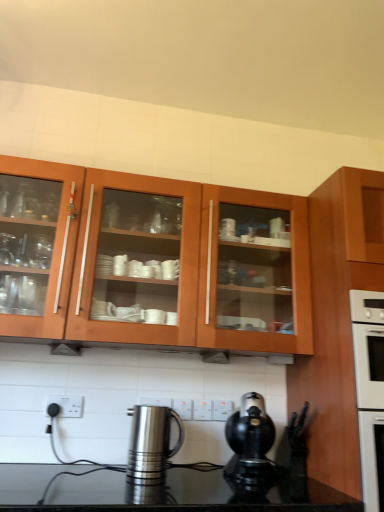
Question: Looking at their shapes, would you say white plastic electric outlet at center, which ranks as the 2th electric outlet in back-to-front order, is wider or thinner than wooden cabinet at upper center, arranged as the 1th cabinetry when viewed from the left?

Choices:
 (A) thin
 (B) wide

Answer: (A)

Question: Is white plastic electric outlet at center, the 2th electric outlet positioned from the right, situated inside wooden cabinet at upper center, arranged as the 1th cabinetry when viewed from the left, or outside?

Choices:
 (A) inside
 (B) outside

Answer: (B)

Question: Based on their relative distances, which object is farther from the white plastic electric outlet at center, the 2th electric outlet viewed from the front?

Choices:
 (A) white plastic electric outlet at lower center, which is the third electric outlet in right-to-left order
 (B) white plastic electric outlet at center, positioned as the third electric outlet in left-to-right order
 (C) wooden cabinet at upper center, arranged as the 1th cabinetry when viewed from the left
 (D) black plastic coffee maker at lower center, which ranks as the 2th kitchen appliance in left-to-right order
 (E) wooden cabinet at right, the first cabinetry from the right

Answer: (E)

Question: Considering the real-world distances, which object is farthest from the wooden cabinet at upper center, which ranks as the second cabinetry in right-to-left order?

Choices:
 (A) black plastic coffee maker at lower center, which ranks as the 2th kitchen appliance in left-to-right order
 (B) white plastic electric outlet at center, positioned as the third electric outlet in left-to-right order
 (C) white plastic electric outlet at lower center, marked as the first electric outlet in a left-to-right arrangement
 (D) white plastic electric outlet at center, the 2th electric outlet viewed from the front
 (E) wooden cabinet at right, the first cabinetry from the right

Answer: (C)